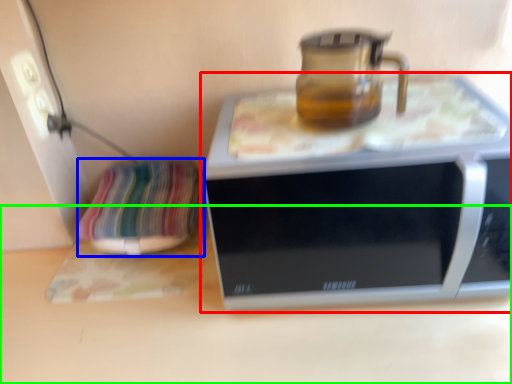
Question: Estimate the real-world distances between objects in this image. Which object is farther from microwave oven (highlighted by a red box), pillow (highlighted by a blue box) or surface (highlighted by a green box)?

Choices:
 (A) pillow
 (B) surface

Answer: (A)